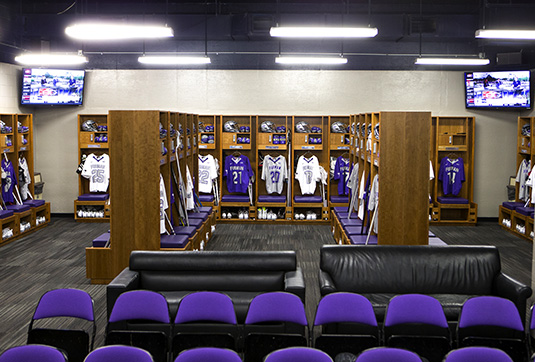
The height and width of the screenshot is (362, 535). What are the coordinates of `ceiling lights` in the screenshot? It's located at (124, 29), (68, 50), (183, 56), (323, 25), (317, 61), (443, 55), (499, 30).